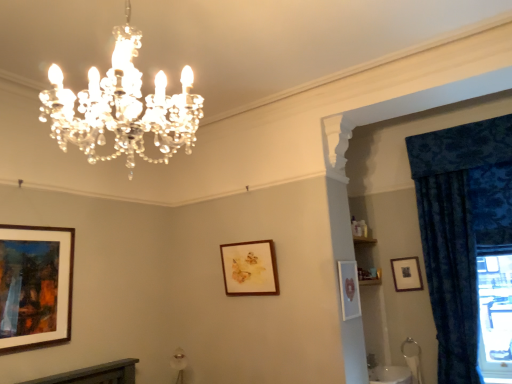
Question: Is clear crystal chandelier at upper center aimed at wooden picture frame at upper right, which is the 4th picture frame from left to right?

Choices:
 (A) no
 (B) yes

Answer: (A)

Question: Is clear crystal chandelier at upper center at the right side of wooden picture frame at upper right, acting as the 1th picture frame starting from the back?

Choices:
 (A) yes
 (B) no

Answer: (B)

Question: From the image's perspective, is clear crystal chandelier at upper center below wooden picture frame at upper right, positioned as the fourth picture frame in front-to-back order?

Choices:
 (A) no
 (B) yes

Answer: (A)

Question: Are clear crystal chandelier at upper center and wooden picture frame at upper right, acting as the 1th picture frame starting from the back, beside each other?

Choices:
 (A) yes
 (B) no

Answer: (B)

Question: Is the position of clear crystal chandelier at upper center more distant than that of wooden picture frame at upper right, which is the 1th picture frame in right-to-left order?

Choices:
 (A) no
 (B) yes

Answer: (A)

Question: From their relative heights in the image, would you say clear crystal chandelier at upper center is taller or shorter than wooden-framed painting at left, the first picture frame viewed from the left?

Choices:
 (A) short
 (B) tall

Answer: (A)

Question: In terms of size, does clear crystal chandelier at upper center appear bigger or smaller than wooden-framed painting at left, which ranks as the 4th picture frame in back-to-front order?

Choices:
 (A) big
 (B) small

Answer: (A)

Question: Considering the positions of point [x=115, y=26] and point [x=14, y=235], is point [x=115, y=26] closer or farther from the camera than point [x=14, y=235]?

Choices:
 (A) farther
 (B) closer

Answer: (B)

Question: Based on their positions, is clear crystal chandelier at upper center located to the left or right of wooden-framed painting at left, the first picture frame viewed from the left?

Choices:
 (A) right
 (B) left

Answer: (A)

Question: Relative to clear crystal chandelier at upper center, is velvet blue curtain at right in front or behind?

Choices:
 (A) front
 (B) behind

Answer: (B)

Question: Would you say velvet blue curtain at right is inside or outside clear crystal chandelier at upper center?

Choices:
 (A) outside
 (B) inside

Answer: (A)

Question: In terms of width, does velvet blue curtain at right look wider or thinner when compared to clear crystal chandelier at upper center?

Choices:
 (A) wide
 (B) thin

Answer: (B)

Question: Is point (470, 266) closer or farther from the camera than point (81, 125)?

Choices:
 (A) farther
 (B) closer

Answer: (A)

Question: Is wooden-framed painting at left, which ranks as the 4th picture frame in back-to-front order, wider or thinner than matte white picture frame at center-right, positioned as the 3th picture frame in back-to-front order?

Choices:
 (A) wide
 (B) thin

Answer: (A)

Question: From a real-world perspective, is wooden-framed painting at left, which ranks as the 4th picture frame in back-to-front order, above or below matte white picture frame at center-right, acting as the 3th picture frame starting from the left?

Choices:
 (A) below
 (B) above

Answer: (B)